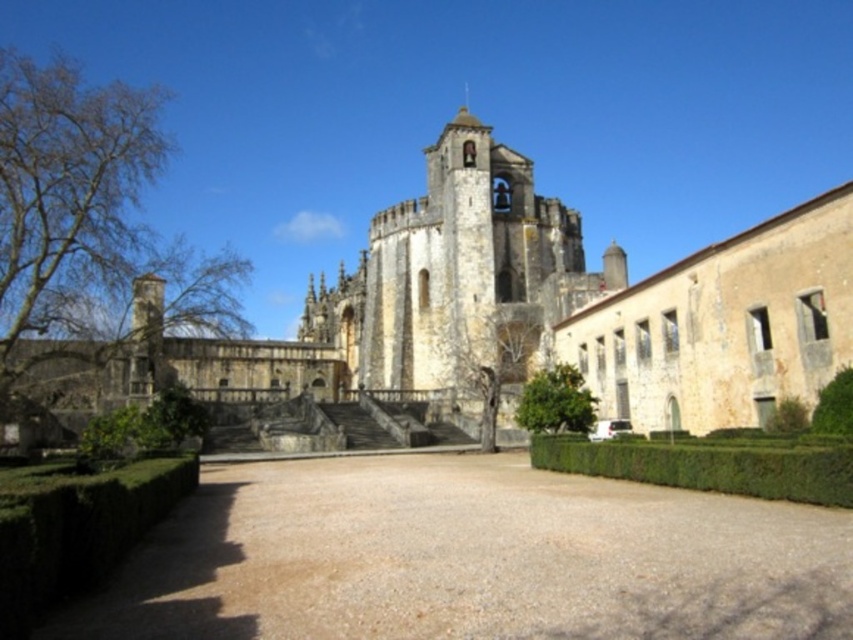
Which of these two, brown gravel driveway at center or green leafy tree at center, stands taller?

green leafy tree at center

Is point (218, 467) in front of point (567, 385)?

That is True.

Which is behind, point (306, 576) or point (579, 374)?

Positioned behind is point (579, 374).

Where is `brown gravel driveway at center`? The image size is (853, 640). brown gravel driveway at center is located at coordinates (469, 557).

Which of these two, stone church at center or green leafy hedge at lower left, stands shorter?

green leafy hedge at lower left

Is stone church at center thinner than green leafy hedge at lower left?

Incorrect, stone church at center's width is not less than green leafy hedge at lower left's.

Is point (514, 177) positioned in front of point (53, 582)?

No.

At what (x,y) coordinates should I click in order to perform the action: click on stone church at center. Please return your answer as a coordinate pair (x, y). The width and height of the screenshot is (853, 640). Looking at the image, I should click on (518, 310).

Is bare branches at left shorter than light beige stone church at center?

Incorrect, bare branches at left's height does not fall short of light beige stone church at center's.

Is point (32, 122) closer to viewer compared to point (439, 378)?

Yes, it is.

Locate an element on the screen. Image resolution: width=853 pixels, height=640 pixels. bare branches at left is located at coordinates (86, 228).